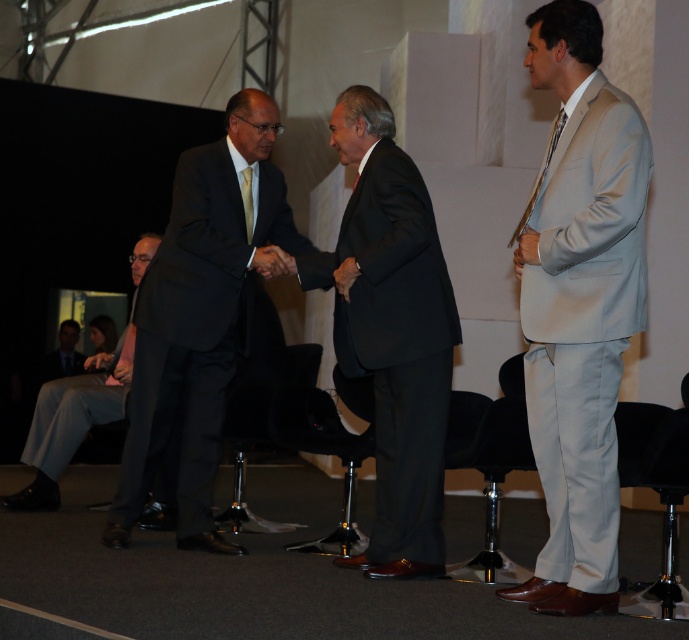
Who is lower down, matte black suit at center or light gray suit at lower left?

light gray suit at lower left

Is matte black suit at center positioned in front of light gray suit at lower left?

Yes.

Which is behind, point (169, 417) or point (121, 410)?

The point (121, 410) is behind.

You are a GUI agent. You are given a task and a screenshot of the screen. Output one action in this format:
    pyautogui.click(x=<x>, y=<y>)
    Task: Click on the matte black suit at center
    This screenshot has height=640, width=689.
    Given the screenshot: What is the action you would take?
    pyautogui.click(x=200, y=316)

Does light gray suit at right have a smaller size compared to matte black suit at lower left?

Incorrect, light gray suit at right is not smaller in size than matte black suit at lower left.

Is light gray suit at right positioned at the back of matte black suit at lower left?

That is False.

Is point (621, 132) positioned in front of point (59, 371)?

Yes, it is in front of point (59, 371).

The height and width of the screenshot is (640, 689). I want to click on light gray suit at right, so click(579, 305).

Which is below, matte black suit at center or black matte suit at center?

Positioned lower is black matte suit at center.

Which of these two, matte black suit at center or black matte suit at center, stands taller?

With more height is black matte suit at center.

Does point (134, 429) come in front of point (373, 317)?

That is False.

Locate an element on the screen. matte black suit at center is located at coordinates (200, 316).